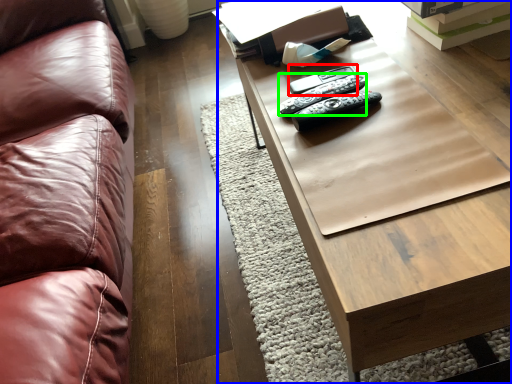
Question: Which object is the closest to the remote (highlighted by a red box)? Choose among these: table (highlighted by a blue box) or remote (highlighted by a green box).

Choices:
 (A) table
 (B) remote

Answer: (B)